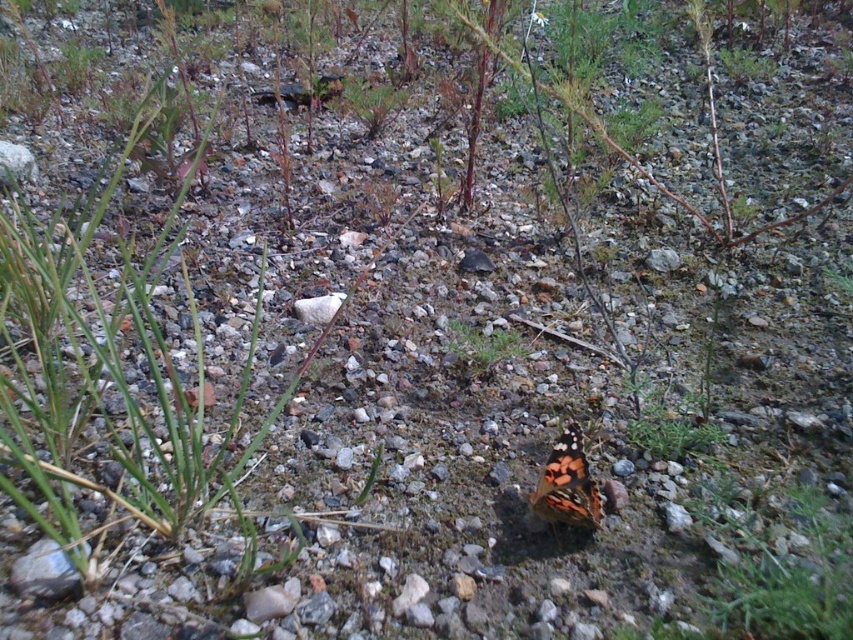
You are standing at the camera position and want to take a closeup photo of the multicolored patterned butterfly at center. The camera has a minimum focusing distance of 12 inches. Can you take the photo without moving closer?

The multicolored patterned butterfly at center and camera are 31.30 inches apart from each other, which is greater than the camera minimum focusing distance of 12 inches. Therefore, you can take the photo without moving closer.

You are standing at the origin point in the scene. You see a point marked at coordinate point (567, 484). What object is located at that point?

The multicolored patterned butterfly at center is represented by point (567, 484).